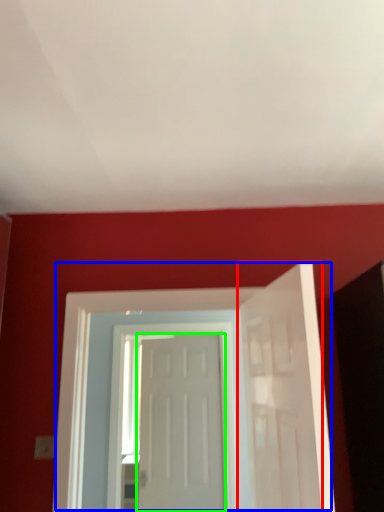
Question: Which object is positioned farthest from door (highlighted by a red box)? Select from door (highlighted by a blue box) and door (highlighted by a green box).

Choices:
 (A) door
 (B) door

Answer: (B)